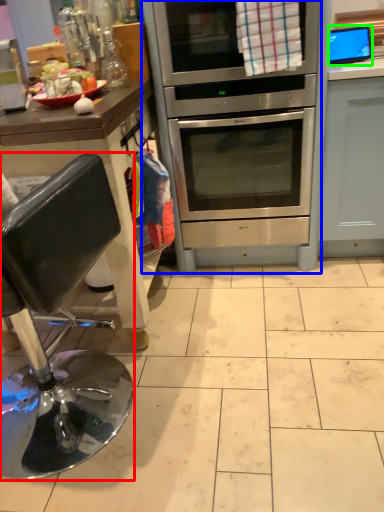
Question: Which is nearer to the chair (highlighted by a red box)? oven (highlighted by a blue box) or appliance (highlighted by a green box).

Choices:
 (A) oven
 (B) appliance

Answer: (A)